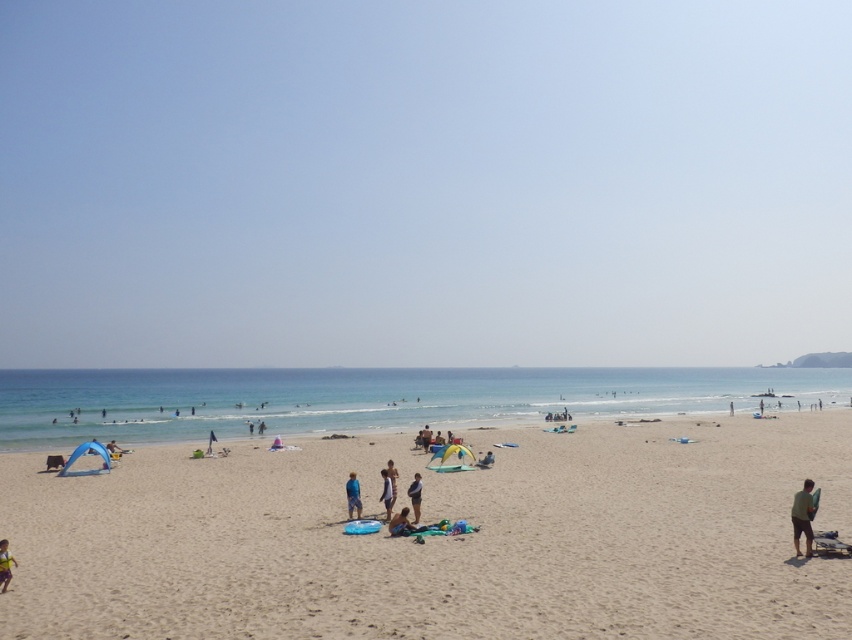
Question: Which of the following is the farthest from the observer?

Choices:
 (A) (393, 477)
 (B) (551, 179)
 (C) (602, 532)

Answer: (B)

Question: Is fine-grained sand at center further to the viewer compared to white cotton shirt at center?

Choices:
 (A) yes
 (B) no

Answer: (B)

Question: Considering the real-world distances, which object is farthest from the transparent blue sky at upper center?

Choices:
 (A) fine-grained sand at center
 (B) striped beach towel at center

Answer: (B)

Question: From the image, what is the correct spatial relationship of light brown fabric bag at center in relation to tan fabric bag at center?

Choices:
 (A) below
 (B) above

Answer: (B)

Question: Which point is closer to the camera taking this photo?

Choices:
 (A) (843, 86)
 (B) (383, 490)

Answer: (B)

Question: In this image, where is blue fabric person at center located relative to light brown fabric bag at center?

Choices:
 (A) above
 (B) below

Answer: (B)